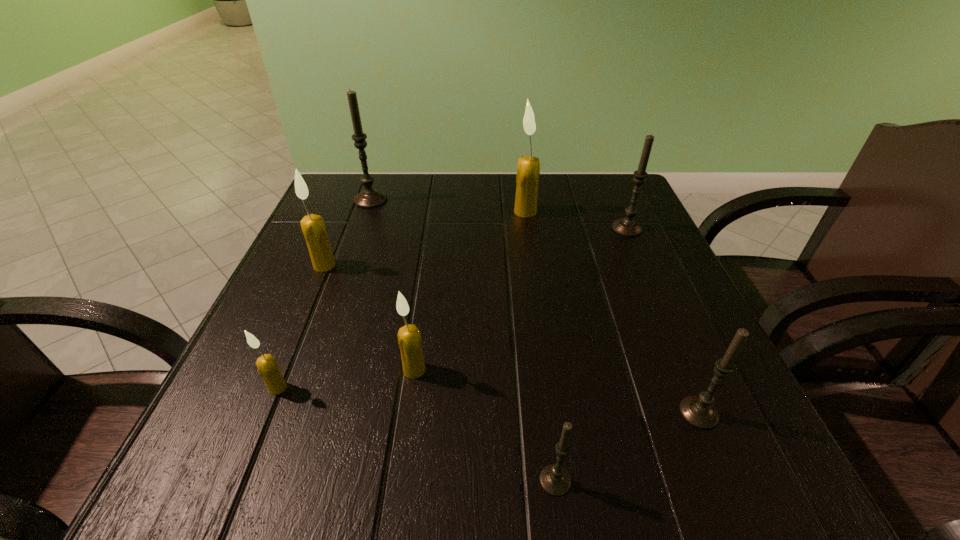
This screenshot has width=960, height=540. In order to click on gray candle that is the closest to the farthest gray candle in this screenshot , I will do `click(627, 226)`.

Where is `free space in the image that satisfies the following two spatial constraints: 1. on the front side of the rightmost cream candle; 2. on the right side of the leftmost gray candle`? free space in the image that satisfies the following two spatial constraints: 1. on the front side of the rightmost cream candle; 2. on the right side of the leftmost gray candle is located at coordinates (367, 212).

The width and height of the screenshot is (960, 540). Identify the location of free location that satisfies the following two spatial constraints: 1. on the front side of the seventh farthest candle; 2. on the left side of the smallest cream candle. pos(268,413).

Identify the location of free space that satisfies the following two spatial constraints: 1. on the front side of the biggest gray candle; 2. on the right side of the farthest cream candle. The height and width of the screenshot is (540, 960). (367, 212).